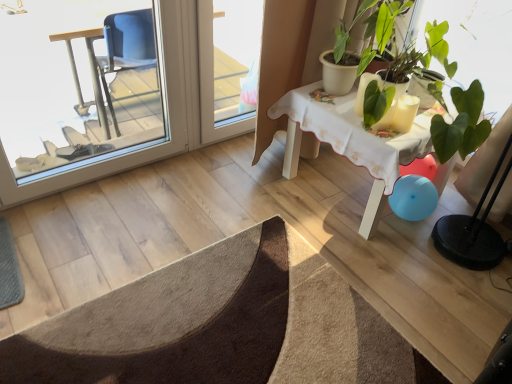
Where is `free space in front of transparent plastic screen door at upper center, marked as the 1th screen door in a right-to-left arrangement`? free space in front of transparent plastic screen door at upper center, marked as the 1th screen door in a right-to-left arrangement is located at coordinates point(234,167).